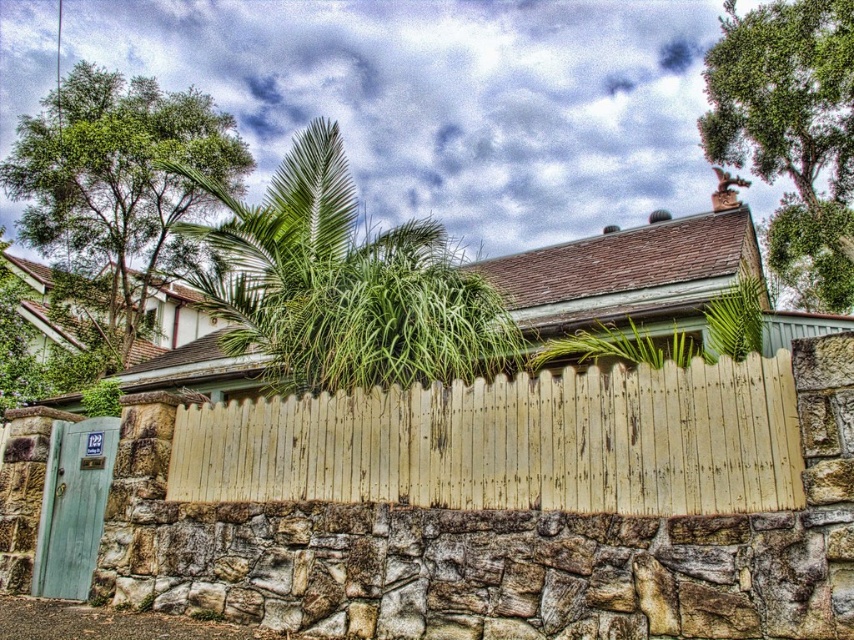
Question: Which object is positioned closest to the green leafy tree at upper left?

Choices:
 (A) green leafy tree at upper right
 (B) green leafy palm at upper center
 (C) yellow weathered wood fence at center

Answer: (B)

Question: Is green leafy tree at upper left to the right of green leafy tree at upper right from the viewer's perspective?

Choices:
 (A) yes
 (B) no

Answer: (B)

Question: Which point is farther to the camera?

Choices:
 (A) green leafy tree at upper right
 (B) yellow weathered wood fence at center
 (C) green leafy tree at upper left
 (D) green leafy palm at upper center

Answer: (C)

Question: In this image, where is yellow weathered wood fence at center located relative to green leafy tree at upper left?

Choices:
 (A) below
 (B) above

Answer: (A)

Question: Which point is farther to the camera?

Choices:
 (A) (445, 273)
 (B) (845, 67)
 (C) (793, 435)
 (D) (114, 324)

Answer: (D)

Question: Is green leafy palm at upper center above green leafy tree at upper left?

Choices:
 (A) no
 (B) yes

Answer: (A)